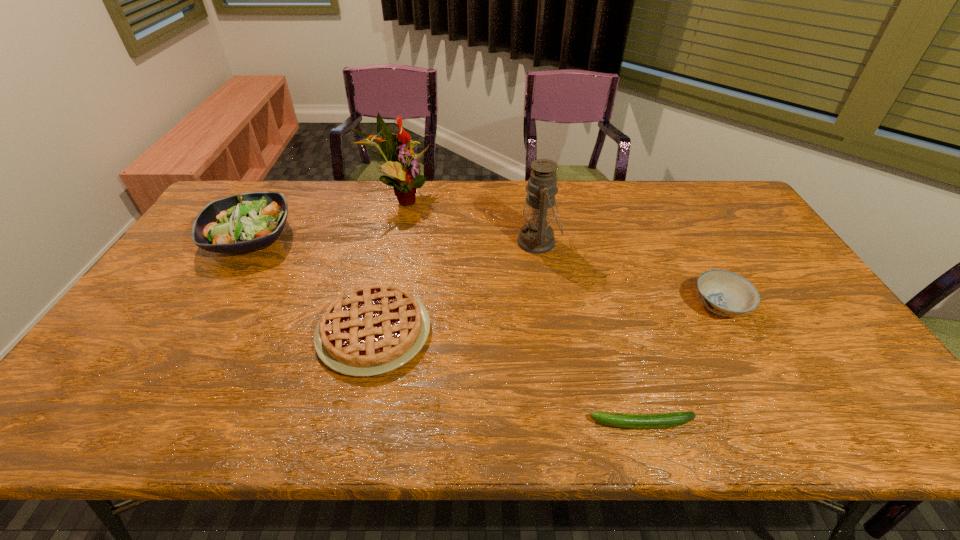
Locate an element on the screen. The width and height of the screenshot is (960, 540). object present at the far left corner is located at coordinates (243, 222).

Identify the location of blank space at the far edge of the desktop. The image size is (960, 540). (309, 214).

At what (x,y) coordinates should I click in order to perform the action: click on free space at the near edge of the desktop. Please return your answer as a coordinate pair (x, y). Image resolution: width=960 pixels, height=540 pixels. Looking at the image, I should click on tap(143, 400).

Find the location of a particular element. blank space at the left edge of the desktop is located at coordinates (128, 360).

I want to click on vacant area at the right edge, so click(x=842, y=391).

The height and width of the screenshot is (540, 960). In order to click on unoccupied area between the bouquet and the zucchini in this screenshot , I will do `click(520, 311)`.

Find the location of `free spot between the third tallest object and the pie`. free spot between the third tallest object and the pie is located at coordinates (312, 285).

You are a GUI agent. You are given a task and a screenshot of the screen. Output one action in this format:
    pyautogui.click(x=<x>, y=<y>)
    Task: Click on the blank region between the leftmost object and the bouquet
    The width and height of the screenshot is (960, 540).
    Given the screenshot: What is the action you would take?
    pyautogui.click(x=324, y=218)

The image size is (960, 540). Find the location of `blank region between the pie and the shortest object`. blank region between the pie and the shortest object is located at coordinates (508, 377).

Identify the location of empty location between the oil lamp and the zucchini. (590, 333).